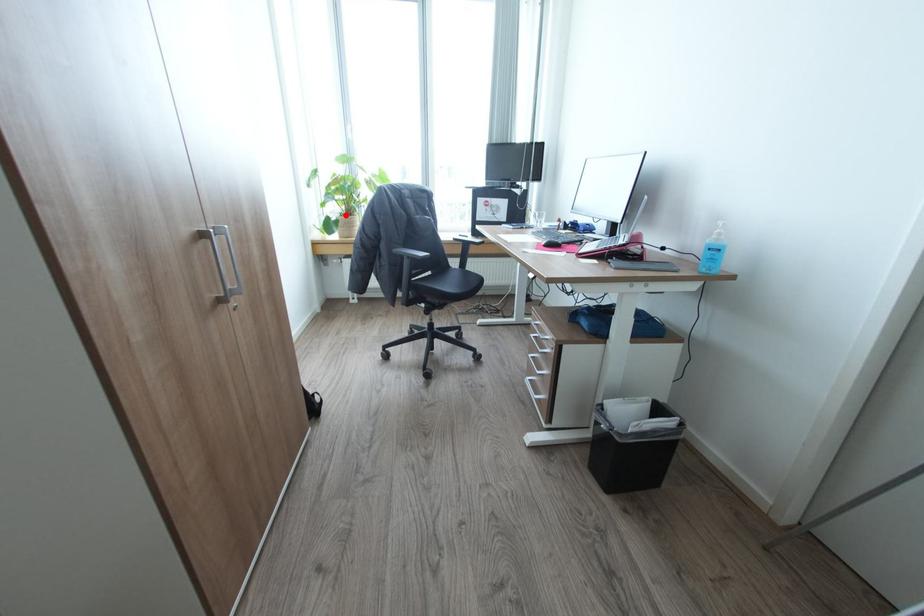
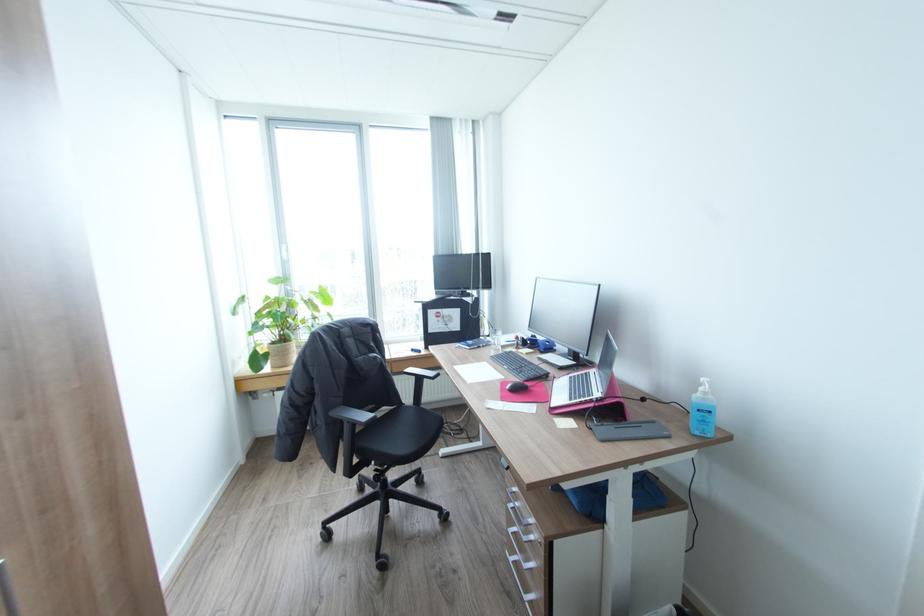
The point at the highlighted location is marked in the first image. Where is the corresponding point in the second image?

(277, 342)